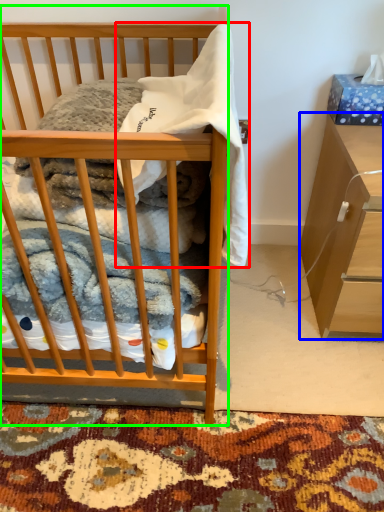
Question: Which object is positioned closest to baby clothe (highlighted by a red box)? Select from cabinetry (highlighted by a blue box) and desk (highlighted by a green box).

Choices:
 (A) cabinetry
 (B) desk

Answer: (B)